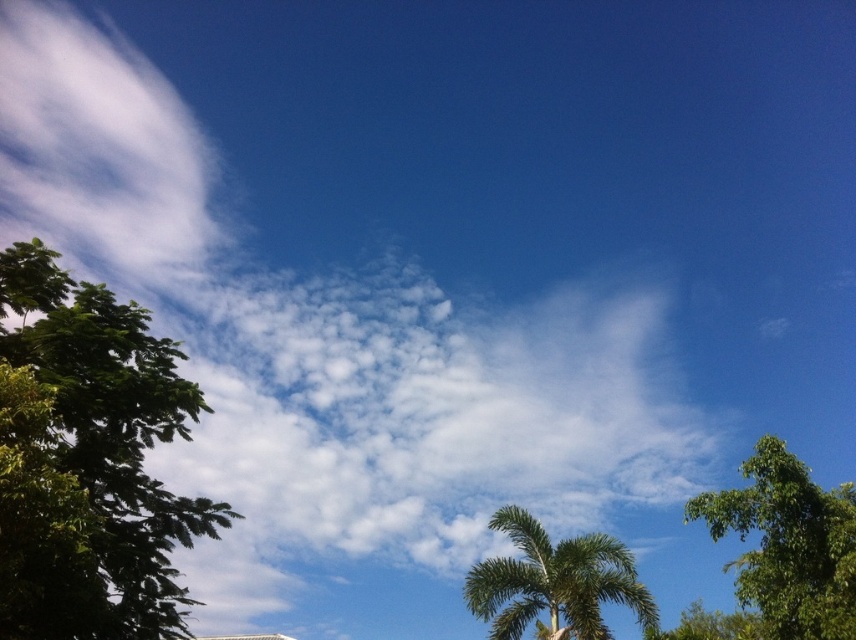
Identify the location of green leafy tree at left. (88, 461).

What do you see at coordinates (88, 461) in the screenshot? The image size is (856, 640). I see `green leafy tree at left` at bounding box center [88, 461].

Who is more distant from viewer, (180, 387) or (854, 625)?

Positioned behind is point (180, 387).

You are a GUI agent. You are given a task and a screenshot of the screen. Output one action in this format:
    pyautogui.click(x=<x>, y=<y>)
    Task: Click on the green leafy tree at left
    This screenshot has height=640, width=856.
    Given the screenshot: What is the action you would take?
    pyautogui.click(x=88, y=461)

This screenshot has height=640, width=856. Describe the element at coordinates (788, 545) in the screenshot. I see `green leafy tree at right` at that location.

Does green leafy tree at right appear on the left side of green leafy palm tree at center?

Incorrect, green leafy tree at right is not on the left side of green leafy palm tree at center.

Is point (853, 612) closer to camera compared to point (542, 540)?

Yes, point (853, 612) is closer to viewer.

Identify the location of green leafy tree at right. (788, 545).

Does green leafy tree at left have a greater width compared to green leafy palm tree at center?

In fact, green leafy tree at left might be narrower than green leafy palm tree at center.

Measure the distance between green leafy tree at left and green leafy palm tree at center.

green leafy tree at left and green leafy palm tree at center are 47.33 feet apart from each other.

I want to click on green leafy tree at left, so click(88, 461).

You are a GUI agent. You are given a task and a screenshot of the screen. Output one action in this format:
    pyautogui.click(x=<x>, y=<y>)
    Task: Click on the green leafy tree at left
    This screenshot has height=640, width=856.
    Given the screenshot: What is the action you would take?
    pyautogui.click(x=88, y=461)